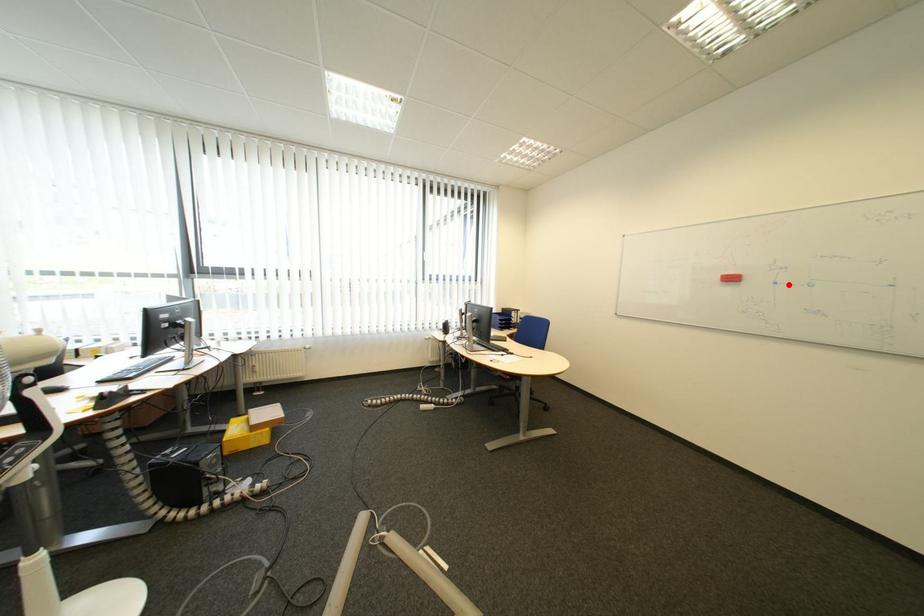
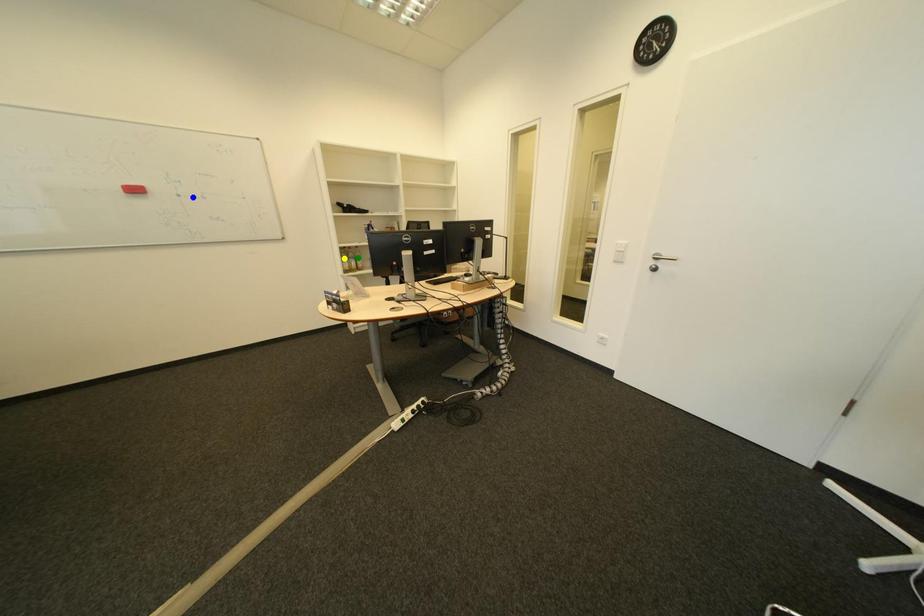
Question: I am providing you with two images of the same scene from different viewpoints. A red point is marked on the first image. You are given multiple points on the second image. Which spot in image 2 lines up with the point in image 1?

Choices:
 (A) yellow point
 (B) green point
 (C) blue point

Answer: (C)